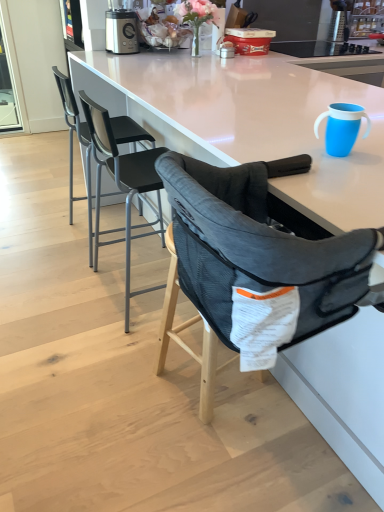
Image resolution: width=384 pixels, height=512 pixels. What do you see at coordinates (342, 127) in the screenshot? I see `blue plastic cup at upper right` at bounding box center [342, 127].

At what (x,y) coordinates should I click in order to perform the action: click on matte plastic container at upper center. Please return your answer as a coordinate pair (x, y). This screenshot has width=384, height=512. Looking at the image, I should click on (250, 40).

Where is `transparent glass screen door at upper left`? This screenshot has width=384, height=512. transparent glass screen door at upper left is located at coordinates (11, 82).

The image size is (384, 512). Describe the element at coordinates (123, 184) in the screenshot. I see `black mesh chair at center, the second chair in the back-to-front sequence` at that location.

Image resolution: width=384 pixels, height=512 pixels. Describe the element at coordinates (121, 31) in the screenshot. I see `metallic silver blender at upper center` at that location.

Locate an element on the screen. The width and height of the screenshot is (384, 512). blue plastic cup at upper right is located at coordinates (342, 127).

Locate an element on the screen. The width and height of the screenshot is (384, 512). tableware that is above the matte plastic container at upper center (from a real-world perspective) is located at coordinates (342, 127).

Looking at their sizes, would you say matte plastic container at upper center is wider or thinner than blue plastic cup at upper right?

matte plastic container at upper center is wider than blue plastic cup at upper right.

Does point (251, 52) lie behind point (335, 109)?

Yes.

Which is behind, matte plastic container at upper center or blue plastic cup at upper right?

matte plastic container at upper center is further away from the camera.

Are mesh fabric high chair at center and black mesh chair at upper left, the 1th chair from the back, making contact?

No, mesh fabric high chair at center is not next to black mesh chair at upper left, the 1th chair from the back.

From a real-world perspective, is mesh fabric high chair at center located beneath black mesh chair at upper left, the 1th chair from the back?

Yes, from a real-world perspective, mesh fabric high chair at center is beneath black mesh chair at upper left, the 1th chair from the back.

Is mesh fabric high chair at center further to the viewer compared to black mesh chair at upper left, the 1th chair from the back?

No, mesh fabric high chair at center is in front of black mesh chair at upper left, the 1th chair from the back.

Between blue plastic cup at upper right and black mesh chair at center, the second chair in the back-to-front sequence, which one has more height?

Standing taller between the two is black mesh chair at center, the second chair in the back-to-front sequence.

Which point is more forward, (351, 140) or (125, 232)?

The point (351, 140) is in front.

From the image's perspective, relative to black mesh chair at center, which is counted as the second chair, starting from the front, is blue plastic cup at upper right above or below?

Based on their image positions, blue plastic cup at upper right is located above black mesh chair at center, which is counted as the second chair, starting from the front.

From the image's perspective, which one is positioned higher, transparent glass screen door at upper left or black mesh chair at upper left, the 1th chair from the back?

transparent glass screen door at upper left is shown above in the image.

Considering the positions of points (3, 121) and (69, 202), is point (3, 121) closer to camera compared to point (69, 202)?

No.

Which chair is the 1st one when counting from the front of the transparent glass screen door at upper left? Please provide its 2D coordinates.

[(82, 144)]

In the scene shown: How distant is transparent glass screen door at upper left from black mesh chair at upper left, placed as the 3th chair when sorted from front to back?

A distance of 1.91 meters exists between transparent glass screen door at upper left and black mesh chair at upper left, placed as the 3th chair when sorted from front to back.

Is black mesh chair at center, the second chair in the back-to-front sequence, positioned before metallic silver blender at upper center?

Yes.

Considering the relative positions of black mesh chair at center, the second chair in the back-to-front sequence, and metallic silver blender at upper center in the image provided, is black mesh chair at center, the second chair in the back-to-front sequence, to the right of metallic silver blender at upper center from the viewer's perspective?

Result: Indeed, black mesh chair at center, the second chair in the back-to-front sequence, is positioned on the right side of metallic silver blender at upper center.

Could you tell me if black mesh chair at center, the second chair in the back-to-front sequence, is turned towards metallic silver blender at upper center?

No, black mesh chair at center, the second chair in the back-to-front sequence, is not facing towards metallic silver blender at upper center.

Based on the photo, from the image's perspective, is black mesh chair at center, the second chair in the back-to-front sequence, located above or below metallic silver blender at upper center?

Clearly, from the image's perspective, black mesh chair at center, the second chair in the back-to-front sequence, is below metallic silver blender at upper center.

Locate an element on the screen. This screenshot has height=512, width=384. appliance on the right of metallic silver blender at upper center is located at coordinates (250, 40).

Would you say matte plastic container at upper center is a long distance from metallic silver blender at upper center?

That's not correct — matte plastic container at upper center is a little close to metallic silver blender at upper center.

Can you tell me how much matte plastic container at upper center and metallic silver blender at upper center differ in facing direction?

The angle between the facing direction of matte plastic container at upper center and the facing direction of metallic silver blender at upper center is 12.6 degrees.

Is matte plastic container at upper center inside the boundaries of metallic silver blender at upper center, or outside?

matte plastic container at upper center is outside metallic silver blender at upper center.

From the image's perspective, which one is positioned lower, black mesh chair at upper left, the 1th chair from the back, or blue plastic cup at upper right?

blue plastic cup at upper right.

Is black mesh chair at upper left, the 1th chair from the back, touching blue plastic cup at upper right?

No, black mesh chair at upper left, the 1th chair from the back, is not in contact with blue plastic cup at upper right.

Which object is closer to the camera, black mesh chair at upper left, placed as the 3th chair when sorted from front to back, or blue plastic cup at upper right?

blue plastic cup at upper right is more forward.

Locate an element on the screen. The width and height of the screenshot is (384, 512). appliance on the left side of blue plastic cup at upper right is located at coordinates (250, 40).

From the image's perspective, which chair is the 3rd one above the mesh fabric high chair at center? Please provide its 2D coordinates.

[(82, 144)]

Looking at the image, which one is located closer to blue plastic cup at upper right, matte plastic container at upper center or metallic silver blender at upper center?

The object closer to blue plastic cup at upper right is matte plastic container at upper center.

When comparing their distances from matte plastic container at upper center, does blue plastic cup at upper right or metallic silver blender at upper center seem further?

The object further to matte plastic container at upper center is blue plastic cup at upper right.

From the image, which object appears to be farther from blue plastic cup at upper right, black mesh chair at center, which is counted as the second chair, starting from the front, or matte plastic container at upper center?

Based on the image, matte plastic container at upper center appears to be further to blue plastic cup at upper right.

Which object lies nearer to the anchor point dark gray mesh highchair at center, positioned as the third chair in back-to-front order, transparent glass screen door at upper left or blue plastic cup at upper right?

Among the two, blue plastic cup at upper right is located nearer to dark gray mesh highchair at center, positioned as the third chair in back-to-front order.

When comparing their distances from dark gray mesh highchair at center, positioned as the third chair in back-to-front order, does blue plastic cup at upper right or black mesh chair at upper left, the 1th chair from the back, seem closer?

blue plastic cup at upper right lies closer to dark gray mesh highchair at center, positioned as the third chair in back-to-front order, than the other object.

Looking at the image, which one is located further to blue plastic cup at upper right, transparent glass screen door at upper left or metallic silver blender at upper center?

transparent glass screen door at upper left is positioned further to the anchor blue plastic cup at upper right.

Estimate the real-world distances between objects in this image. Which object is closer to metallic silver blender at upper center, transparent glass screen door at upper left or dark gray mesh highchair at center, the 1th chair viewed from the front?

dark gray mesh highchair at center, the 1th chair viewed from the front, lies closer to metallic silver blender at upper center than the other object.

From the image, which object appears to be farther from dark gray mesh highchair at center, positioned as the third chair in back-to-front order, blue plastic cup at upper right or mesh fabric high chair at center?

mesh fabric high chair at center is further to dark gray mesh highchair at center, positioned as the third chair in back-to-front order.

Find the location of a particular element. The image size is (384, 512). kitchen appliance situated between transparent glass screen door at upper left and matte plastic container at upper center from left to right is located at coordinates coord(121,31).

The image size is (384, 512). Find the location of `bar stool located between black mesh chair at center, which is counted as the second chair, starting from the front, and blue plastic cup at upper right in the left-right direction`. bar stool located between black mesh chair at center, which is counted as the second chair, starting from the front, and blue plastic cup at upper right in the left-right direction is located at coordinates (183, 341).

Where is `bar stool positioned between dark gray mesh highchair at center, the 1th chair viewed from the front, and matte plastic container at upper center from near to far`? This screenshot has height=512, width=384. bar stool positioned between dark gray mesh highchair at center, the 1th chair viewed from the front, and matte plastic container at upper center from near to far is located at coordinates (183, 341).

This screenshot has width=384, height=512. Find the location of `tableware between dark gray mesh highchair at center, the 1th chair viewed from the front, and mesh fabric high chair at center, along the z-axis`. tableware between dark gray mesh highchair at center, the 1th chair viewed from the front, and mesh fabric high chair at center, along the z-axis is located at coordinates (342, 127).